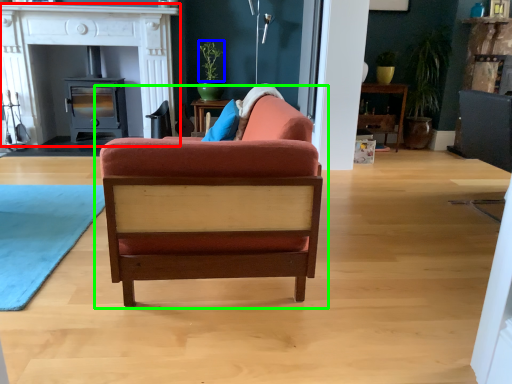
Question: Estimate the real-world distances between objects in this image. Which object is farther from fireplace (highlighted by a red box), plant (highlighted by a blue box) or chair (highlighted by a green box)?

Choices:
 (A) plant
 (B) chair

Answer: (B)